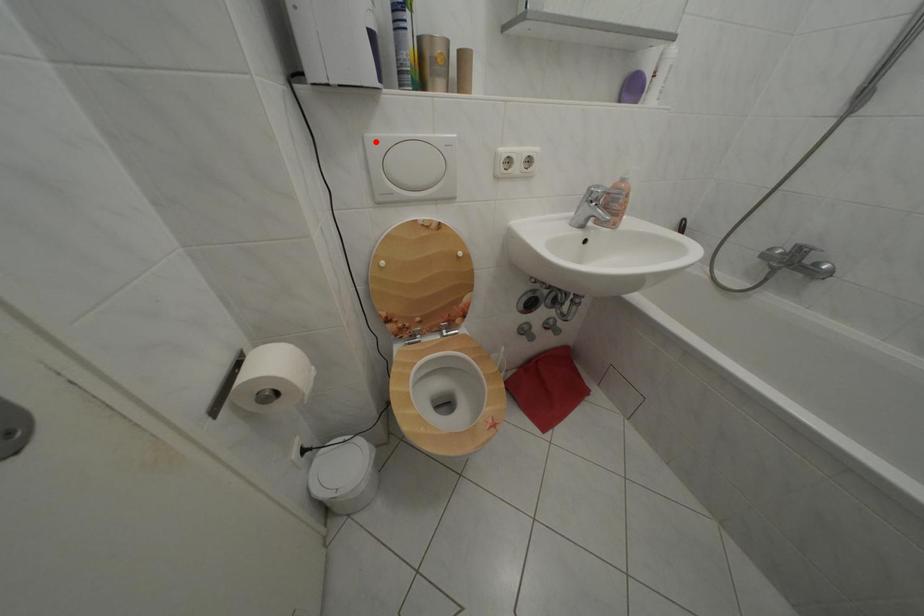
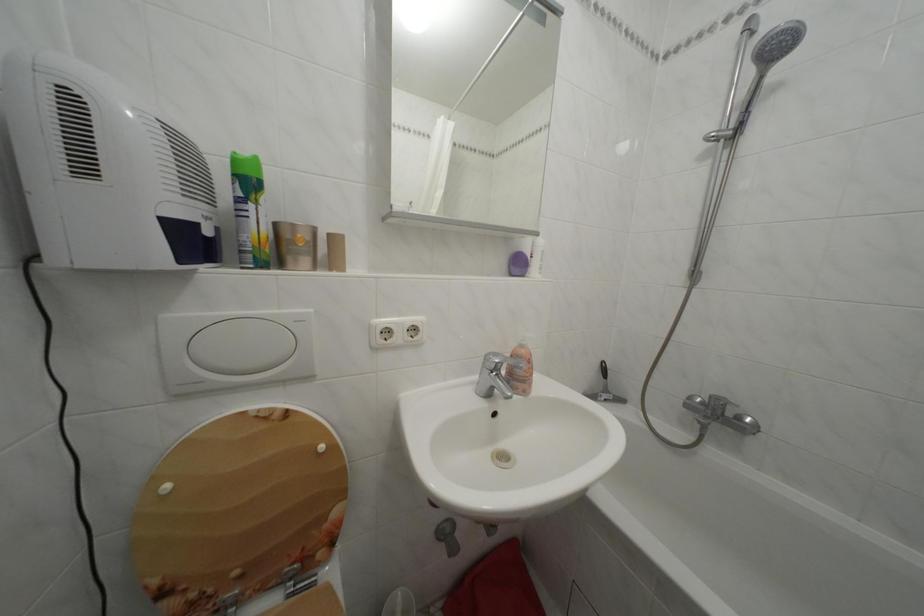
Question: I am providing you with two images of the same scene from different viewpoints. A red point is marked on the first image. Can you still see the location of the red point in image 2?

Choices:
 (A) Yes
 (B) No

Answer: (A)